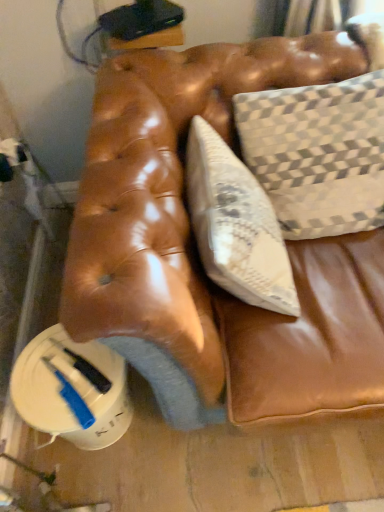
Question: From a real-world perspective, is textured beige pillow at upper right positioned above or below leather couch cushion at center?

Choices:
 (A) above
 (B) below

Answer: (A)

Question: Would you say textured beige pillow at upper right is to the left or to the right of leather couch cushion at center in the picture?

Choices:
 (A) right
 (B) left

Answer: (A)

Question: Does point (324, 164) appear closer or farther from the camera than point (377, 312)?

Choices:
 (A) closer
 (B) farther

Answer: (B)

Question: Is point (206, 323) positioned closer to the camera than point (334, 208)?

Choices:
 (A) closer
 (B) farther

Answer: (A)

Question: From the image's perspective, is leather couch cushion at center positioned above or below textured beige pillow at upper right?

Choices:
 (A) above
 (B) below

Answer: (B)

Question: Do you think leather couch cushion at center is within textured beige pillow at upper right, or outside of it?

Choices:
 (A) outside
 (B) inside

Answer: (A)

Question: In terms of height, does leather couch cushion at center look taller or shorter compared to textured beige pillow at upper right?

Choices:
 (A) tall
 (B) short

Answer: (B)